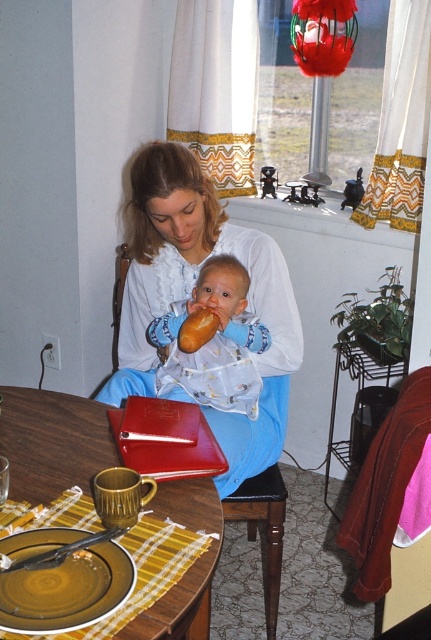
Who is lower down, matte white blouse at center or matte brown bread at center?

Positioned lower is matte brown bread at center.

Does matte white blouse at center have a smaller size compared to matte brown bread at center?

Actually, matte white blouse at center might be larger than matte brown bread at center.

The width and height of the screenshot is (431, 640). In order to click on matte white blouse at center in this screenshot , I will do `click(190, 294)`.

Does yellow fabric placemat at lower left lie in front of soft blue fabric at center?

Yes.

Which is behind, point (77, 442) or point (187, 380)?

Positioned behind is point (187, 380).

The width and height of the screenshot is (431, 640). I want to click on yellow fabric placemat at lower left, so click(53, 442).

From the picture: Does matte white blouse at center appear on the left side of blue fabric chair at center?

Indeed, matte white blouse at center is positioned on the left side of blue fabric chair at center.

This screenshot has width=431, height=640. What do you see at coordinates (190, 294) in the screenshot? I see `matte white blouse at center` at bounding box center [190, 294].

Locate an element on the screen. This screenshot has height=640, width=431. matte white blouse at center is located at coordinates tap(190, 294).

At what (x,y) coordinates should I click in order to perform the action: click on matte white blouse at center. Please return your answer as a coordinate pair (x, y). Looking at the image, I should click on (190, 294).